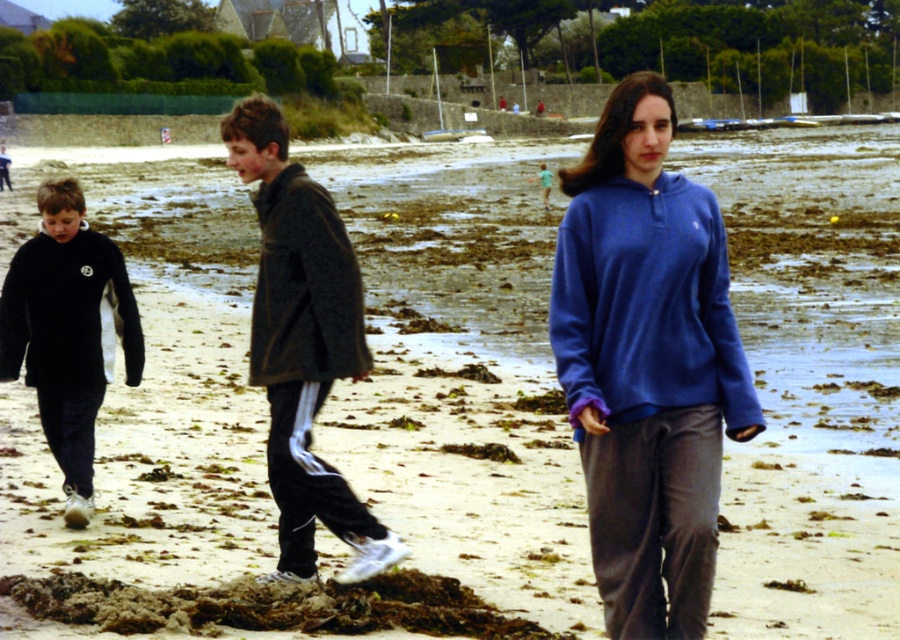
You are standing at the beach and want to walk to the point marked at coordinates point (x=648, y=280). Which direction should you go relative to the point marked at coordinates point (x=162, y=605)?

You should walk towards the point marked at coordinates point (x=648, y=280), which is in front of the point marked at coordinates point (x=162, y=605).

You are standing at the origin point of the coordinate system. The dark gray fleece jacket at center is located at point (302, 342). If you want to walk towards the dark gray fleece jacket at center, in which direction should you move?

You should move in the direction of point (302, 342) to reach the dark gray fleece jacket at center.